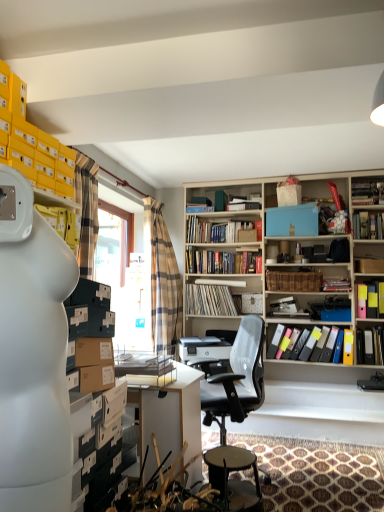
Question: Can you confirm if black leather bar stool at center is smaller than hardcover books at center, the 4th book when ordered from top to bottom?

Choices:
 (A) yes
 (B) no

Answer: (A)

Question: Is black leather bar stool at center not close to hardcover books at center, placed as the seventh book when sorted from bottom to top?

Choices:
 (A) no
 (B) yes

Answer: (B)

Question: Is black leather bar stool at center closer to the viewer compared to hardcover books at center, placed as the seventh book when sorted from bottom to top?

Choices:
 (A) no
 (B) yes

Answer: (B)

Question: From the image's perspective, is black leather bar stool at center located beneath hardcover books at center, the 4th book when ordered from top to bottom?

Choices:
 (A) yes
 (B) no

Answer: (A)

Question: Can you confirm if black leather bar stool at center is shorter than hardcover books at center, placed as the seventh book when sorted from bottom to top?

Choices:
 (A) no
 (B) yes

Answer: (A)

Question: From a real-world perspective, is black leather bar stool at center located higher than hardcover books at center, the 4th book when ordered from top to bottom?

Choices:
 (A) no
 (B) yes

Answer: (A)

Question: Is yellow file folder at right, which appears as the second book when ordered from the bottom, placed right next to multicolored plastic folders at center right, which is the tenth book in top-to-bottom order?

Choices:
 (A) yes
 (B) no

Answer: (B)

Question: Does yellow file folder at right, which ranks as the ninth book in top-to-bottom order, have a larger size compared to multicolored plastic folders at center right, which is the tenth book in top-to-bottom order?

Choices:
 (A) no
 (B) yes

Answer: (A)

Question: Could you tell me if yellow file folder at right, which appears as the second book when ordered from the bottom, is facing multicolored plastic folders at center right, marked as the first book in a bottom-to-top arrangement?

Choices:
 (A) no
 (B) yes

Answer: (A)

Question: From the image's perspective, is yellow file folder at right, which appears as the second book when ordered from the bottom, on multicolored plastic folders at center right, which is the tenth book in top-to-bottom order?

Choices:
 (A) no
 (B) yes

Answer: (B)

Question: Does yellow file folder at right, which ranks as the ninth book in top-to-bottom order, have a lesser width compared to multicolored plastic folders at center right, which is the tenth book in top-to-bottom order?

Choices:
 (A) yes
 (B) no

Answer: (A)

Question: Can you confirm if yellow file folder at right, which appears as the second book when ordered from the bottom, is wider than multicolored plastic folders at center right, marked as the first book in a bottom-to-top arrangement?

Choices:
 (A) no
 (B) yes

Answer: (A)

Question: Considering the relative sizes of white vinyl records at center, positioned as the eighth book in top-to-bottom order, and yellow file folder at right, which ranks as the ninth book in top-to-bottom order, in the image provided, is white vinyl records at center, positioned as the eighth book in top-to-bottom order, smaller than yellow file folder at right, which ranks as the ninth book in top-to-bottom order,?

Choices:
 (A) yes
 (B) no

Answer: (B)